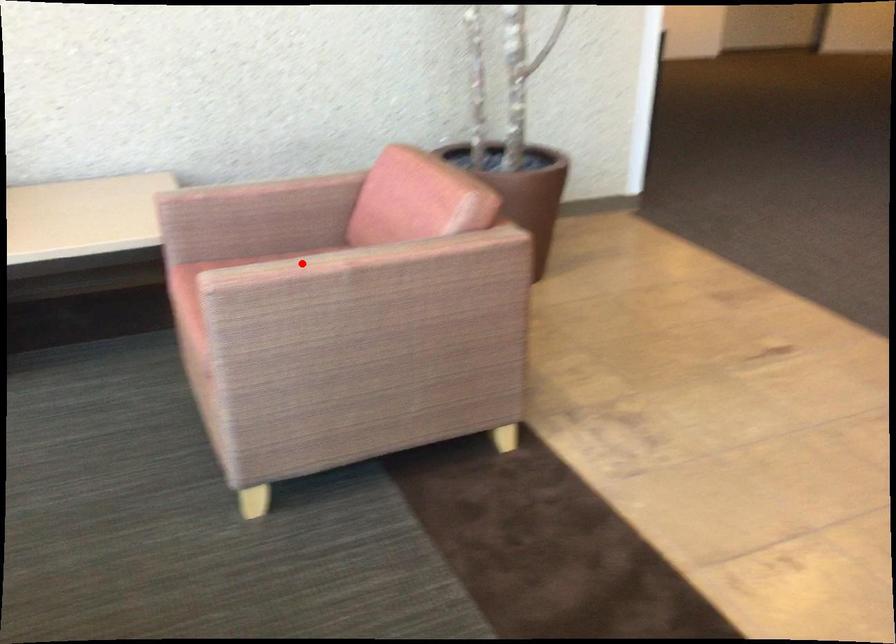
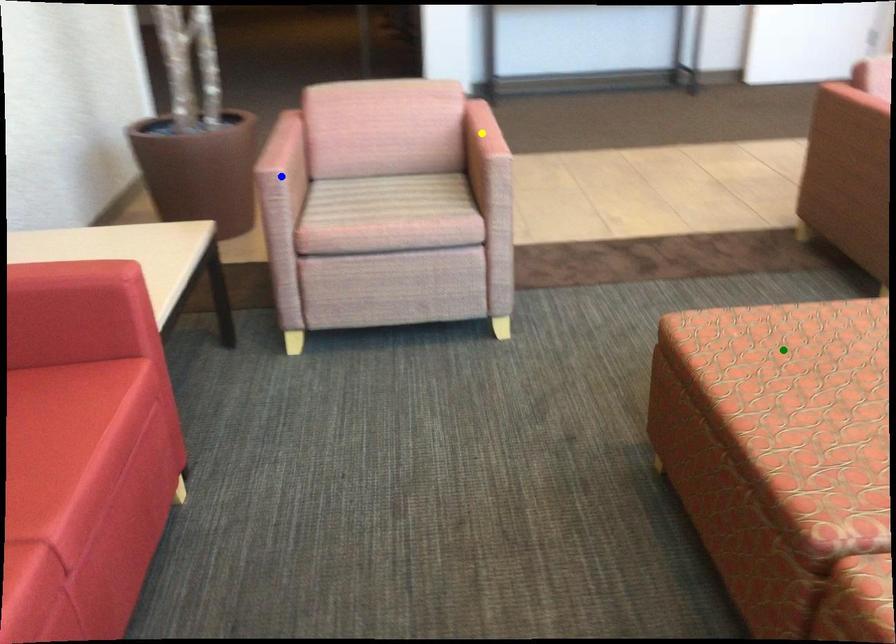
Question: I am providing you with two images of the same scene from different viewpoints. A red point is marked on the first image. You are given multiple points on the second image. Can you choose the point in image 2 that corresponds to the point in image 1?

Choices:
 (A) yellow point
 (B) green point
 (C) blue point

Answer: (A)